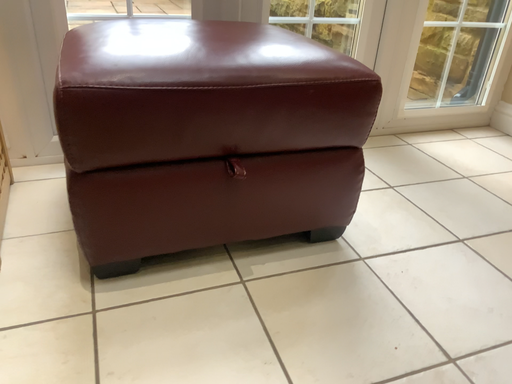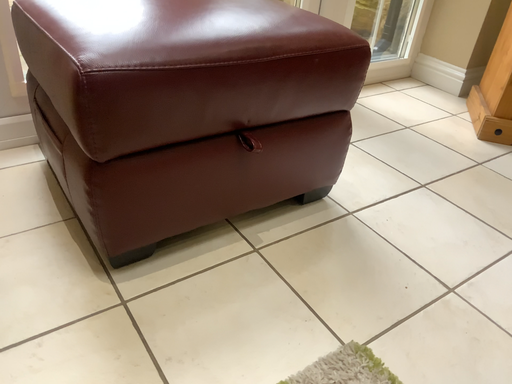
Question: How did the camera likely rotate when shooting the video?

Choices:
 (A) rotated left
 (B) rotated right

Answer: (B)